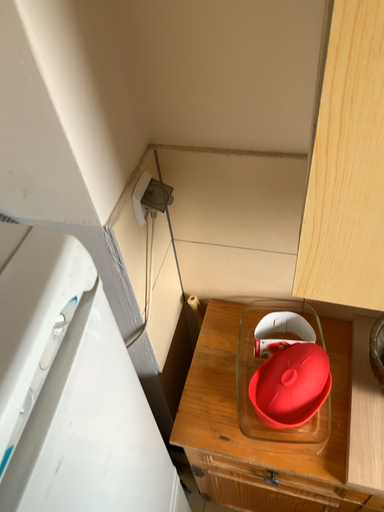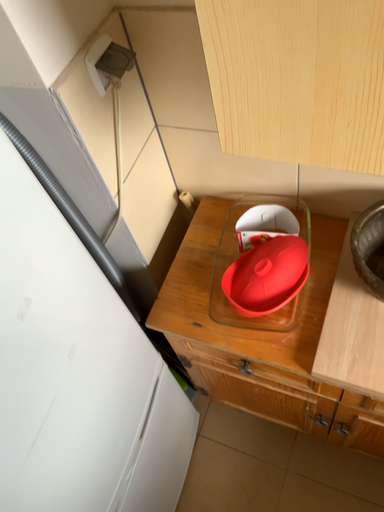
Question: How did the camera likely rotate when shooting the video?

Choices:
 (A) rotated upward
 (B) rotated downward

Answer: (B)